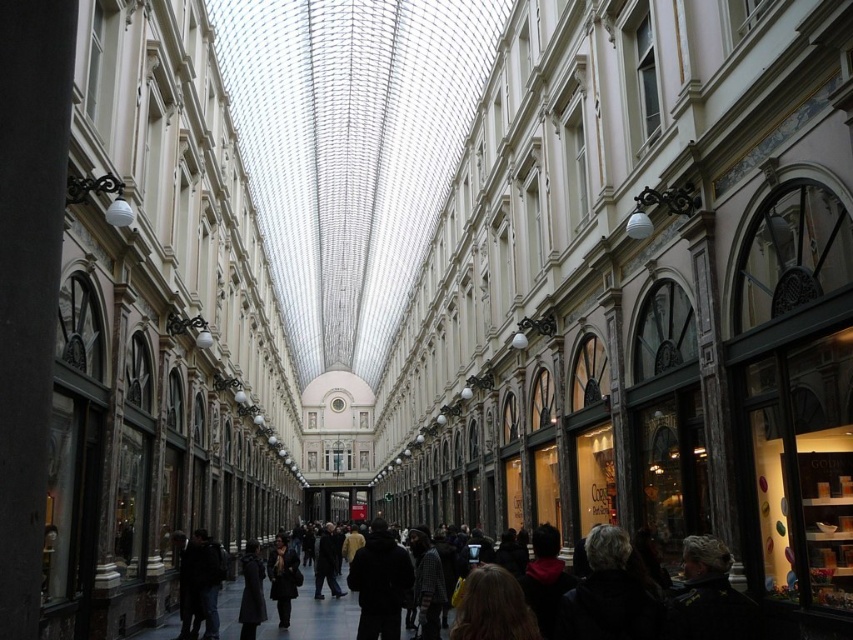
Is dark woolen coat at center thinner than dark gray wool coat at center?

Incorrect, dark woolen coat at center's width is not less than dark gray wool coat at center's.

Who is more distant from viewer, (570, 627) or (282, 552)?

The point (282, 552) is behind.

Image resolution: width=853 pixels, height=640 pixels. What do you see at coordinates (654, 596) in the screenshot? I see `dark woolen coat at center` at bounding box center [654, 596].

You are a GUI agent. You are given a task and a screenshot of the screen. Output one action in this format:
    pyautogui.click(x=<x>, y=<y>)
    Task: Click on the dark woolen coat at center
    This screenshot has height=640, width=853.
    Given the screenshot: What is the action you would take?
    pyautogui.click(x=654, y=596)